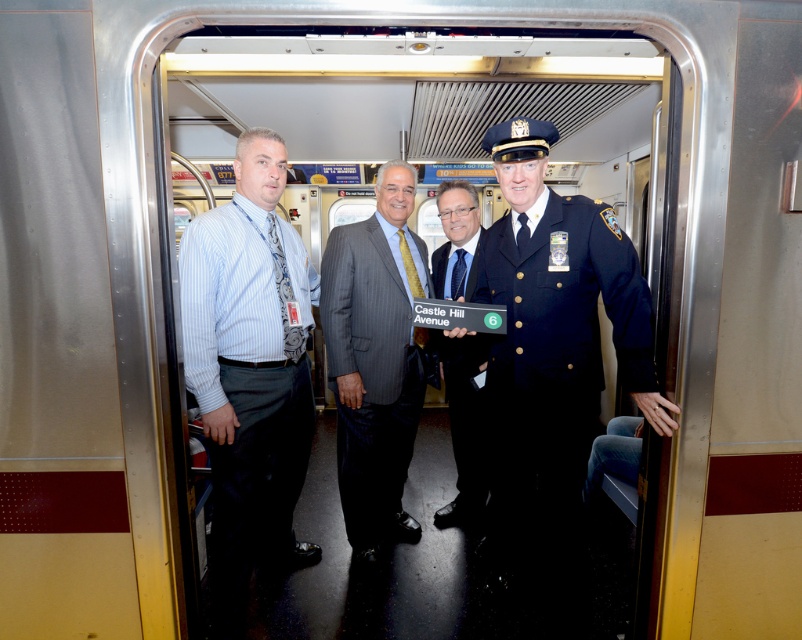
What is the spatial relationship between the navy blue uniform at center and the other individuals in the subway car?

The navy blue uniform at center is positioned at coordinates point (x=553, y=362), placing it centrally within the subway car relative to the other individuals.

You are a passenger in the subway car and need to determine which of the two central individuals is taller. The two people in question are wearing the gray pinstripe suit at center and the dark blue uniform at center. Can you identify which one is taller?

The gray pinstripe suit at center is taller than the dark blue uniform at center.